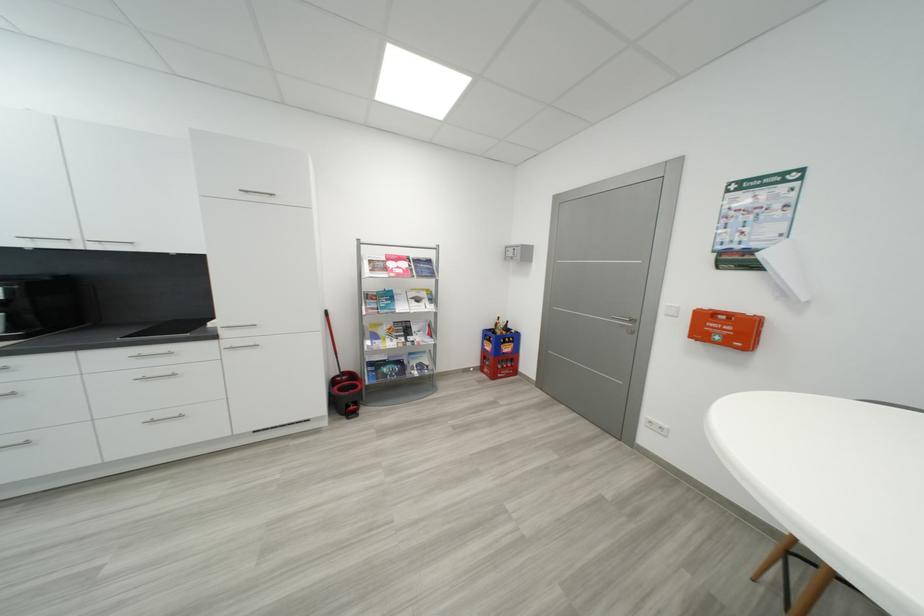
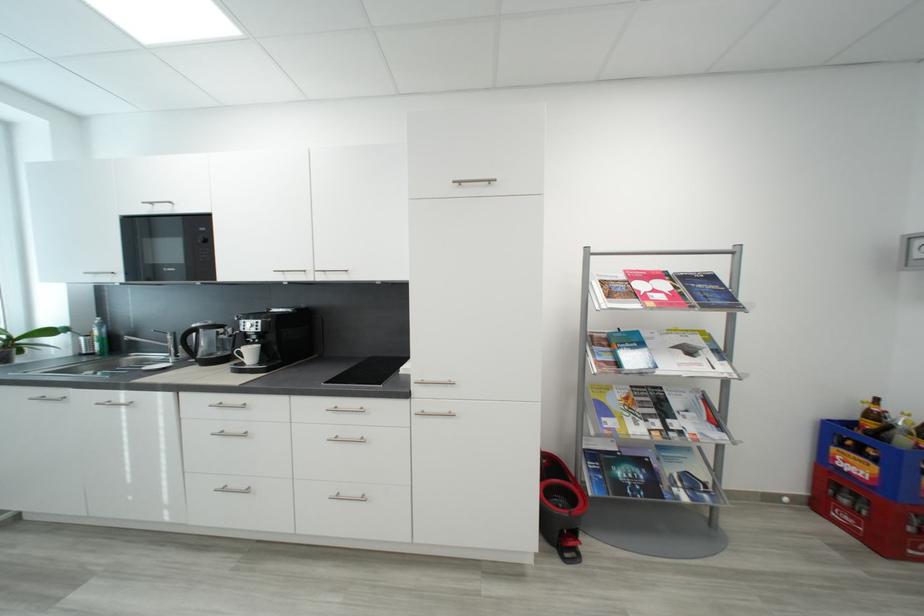
In the second image, find the point that corresponds to the point at 435,262 in the first image.

(718, 280)